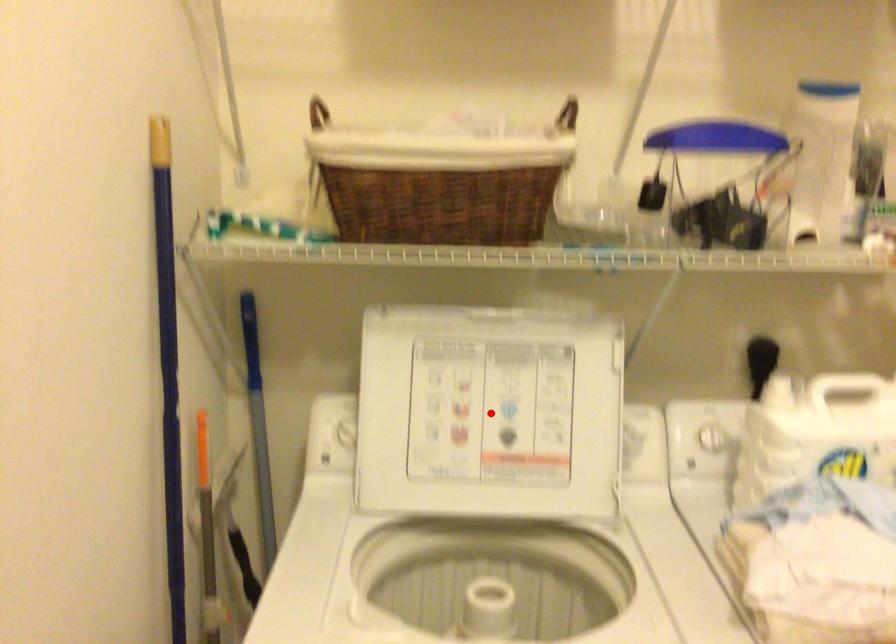
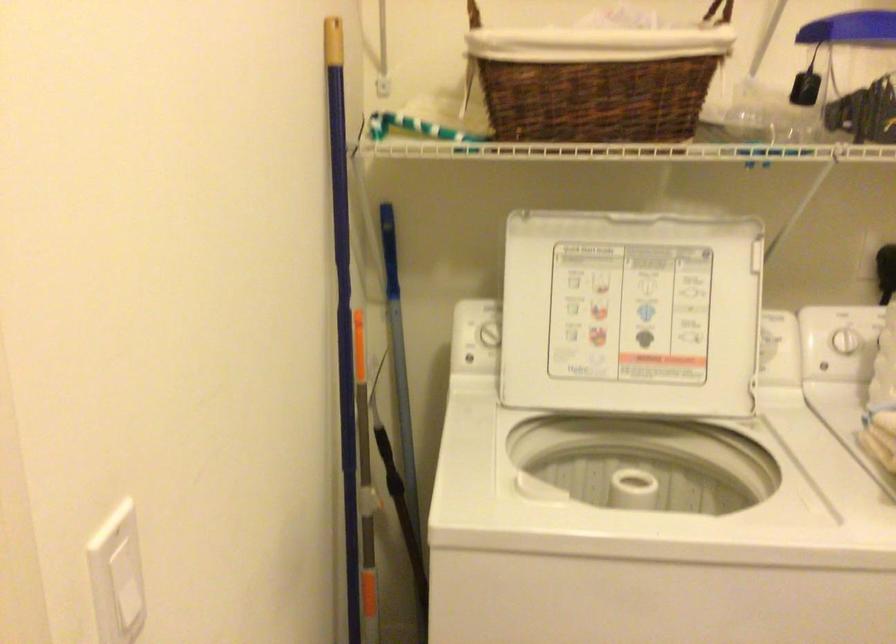
In the second image, find the point that corresponds to the highlighted location in the first image.

(631, 313)